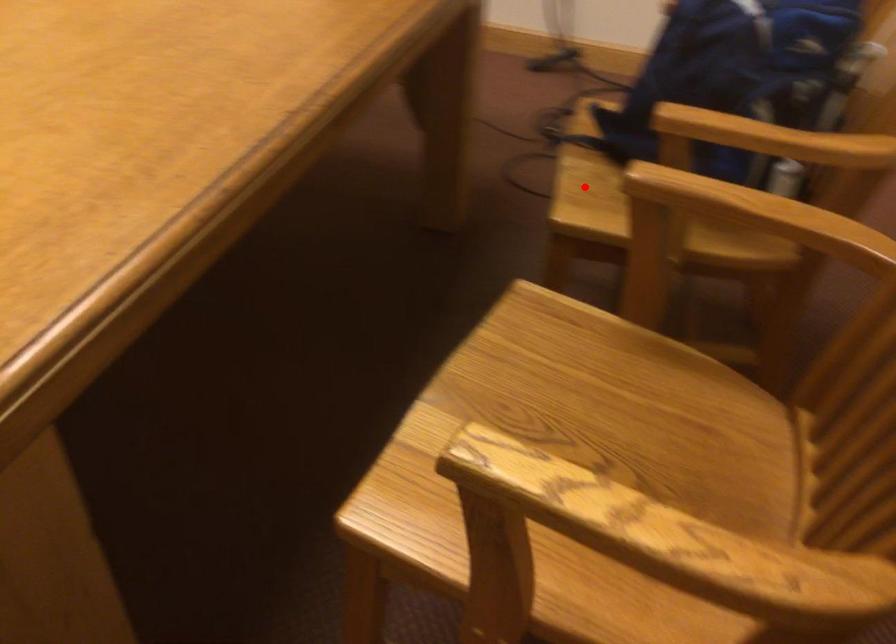
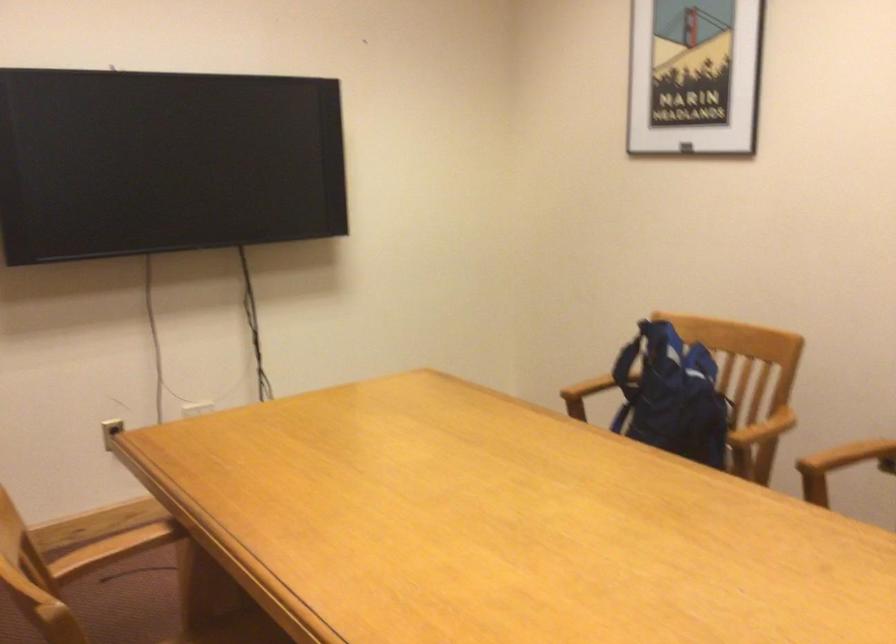
Question: I am providing you with two images of the same scene from different viewpoints. A red point is marked on the first image. At the location where the point appears in image 1, is it still visible in image 2?

Choices:
 (A) Yes
 (B) No

Answer: (B)